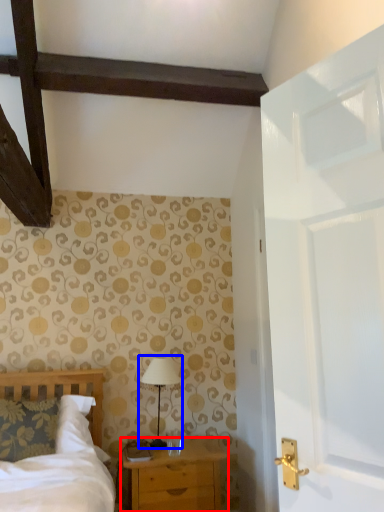
Question: Among these objects, which one is farthest to the camera, chest of drawers (highlighted by a red box) or table lamp (highlighted by a blue box)?

Choices:
 (A) chest of drawers
 (B) table lamp

Answer: (B)